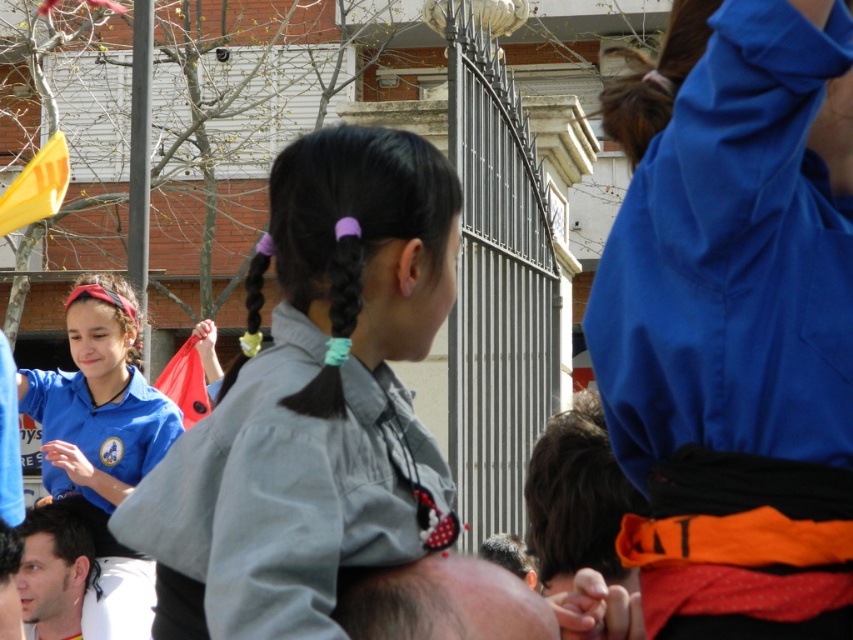
Does dark brown hair at lower left have a lesser width compared to yellow fabric flag at upper left?

Yes.

Who is more distant from viewer, (38, 532) or (22, 176)?

Point (22, 176)

Between point (50, 627) and point (47, 193), which one is positioned behind?

The point (47, 193) is more distant.

I want to click on dark brown hair at lower left, so click(x=56, y=570).

Who is positioned more to the right, blue fabric at upper right or smooth dark brown hair at center?

From the viewer's perspective, blue fabric at upper right appears more on the right side.

The height and width of the screenshot is (640, 853). What do you see at coordinates (734, 321) in the screenshot?
I see `blue fabric at upper right` at bounding box center [734, 321].

Who is more distant from viewer, (758, 115) or (347, 253)?

The point (347, 253) is behind.

The width and height of the screenshot is (853, 640). In order to click on blue fabric at upper right in this screenshot , I will do `click(734, 321)`.

Which of these two, gray fabric shirt at center or yellow fabric flag at upper left, stands shorter?

yellow fabric flag at upper left is shorter.

Is point (279, 388) more distant than point (39, 180)?

That is False.

Image resolution: width=853 pixels, height=640 pixels. What are the coordinates of `gray fabric shirt at center` in the screenshot? It's located at (312, 403).